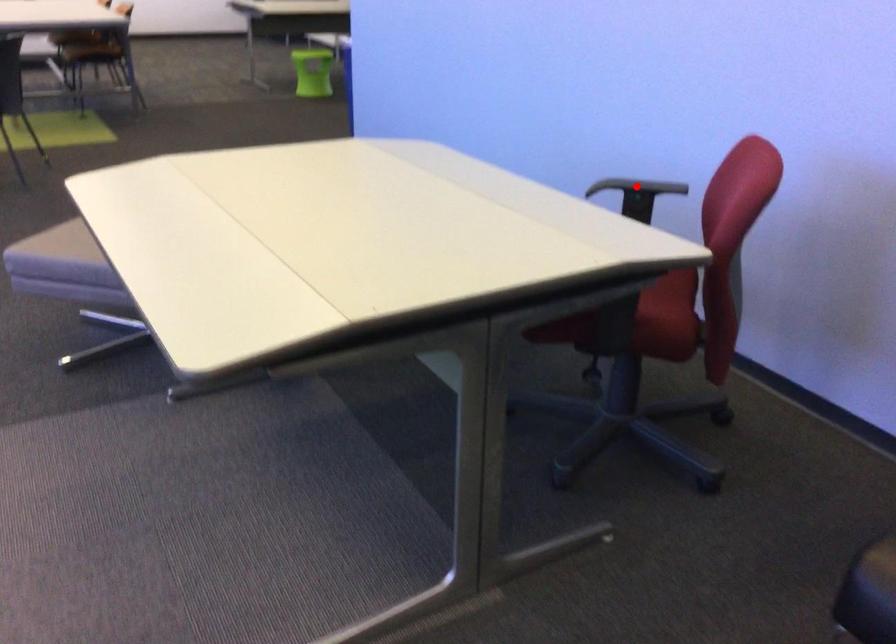
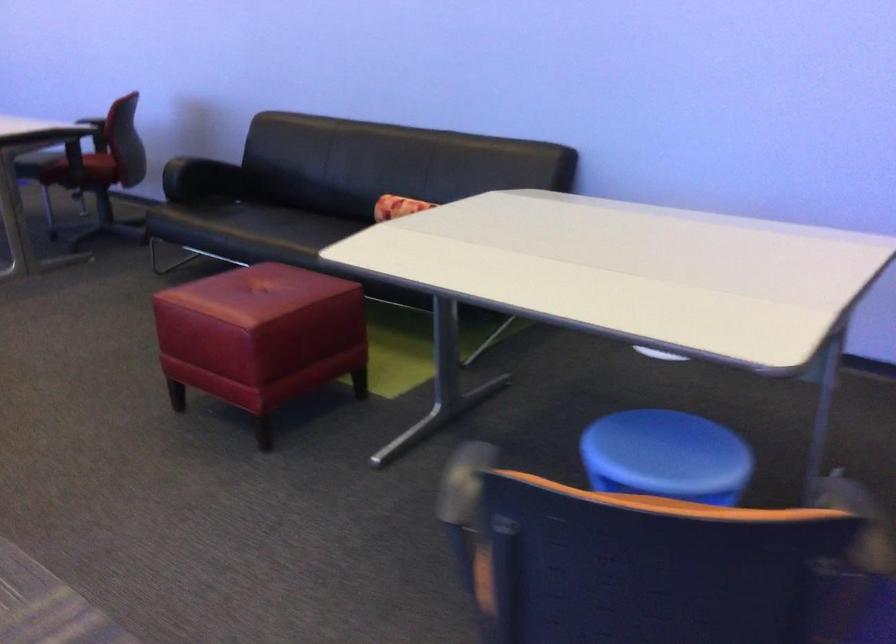
Question: I am providing you with two images of the same scene from different viewpoints. A red point is marked on the first image. At the location where the point appears in image 1, is it still visible in image 2?

Choices:
 (A) Yes
 (B) No

Answer: (B)